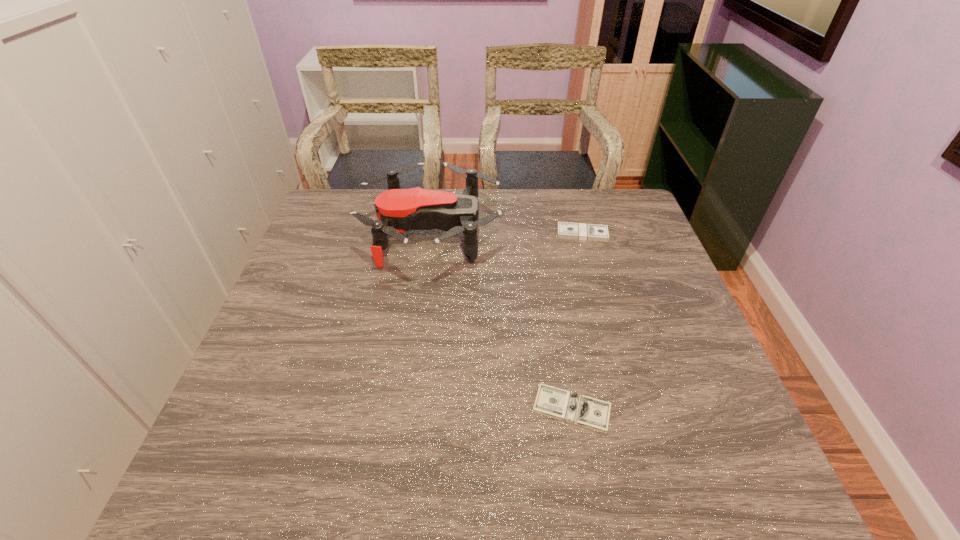
Identify the location of object that can be found as the closest to the tallest object. (565, 230).

The image size is (960, 540). In order to click on the second closest object relative to the shorter dollar in this screenshot , I will do `click(565, 230)`.

Identify the location of free location that satisfies the following two spatial constraints: 1. on the camera side of the tallest object; 2. on the back side of the taller dollar. (432, 234).

Find the location of `free space that satisfies the following two spatial constraints: 1. on the camera side of the tallest object; 2. on the back side of the shorter dollar`. free space that satisfies the following two spatial constraints: 1. on the camera side of the tallest object; 2. on the back side of the shorter dollar is located at coordinates (409, 409).

The width and height of the screenshot is (960, 540). In order to click on vacant space that satisfies the following two spatial constraints: 1. on the camera side of the leftmost object; 2. on the left side of the taller dollar in this screenshot , I will do `click(432, 234)`.

This screenshot has height=540, width=960. Find the location of `free space that satisfies the following two spatial constraints: 1. on the camera side of the drone; 2. on the back side of the second shortest object`. free space that satisfies the following two spatial constraints: 1. on the camera side of the drone; 2. on the back side of the second shortest object is located at coordinates (432, 234).

You are a GUI agent. You are given a task and a screenshot of the screen. Output one action in this format:
    pyautogui.click(x=<x>, y=<y>)
    Task: Click on the free space in the image that satisfies the following two spatial constraints: 1. on the camera side of the shorter dollar; 2. on the right side of the leftmost object
    The width and height of the screenshot is (960, 540).
    Given the screenshot: What is the action you would take?
    pyautogui.click(x=409, y=409)

Identify the location of free space in the image that satisfies the following two spatial constraints: 1. on the camera side of the tallest object; 2. on the left side of the second tallest object. (432, 234).

This screenshot has height=540, width=960. What are the coordinates of `free space that satisfies the following two spatial constraints: 1. on the camera side of the leftmost object; 2. on the right side of the taller dollar` in the screenshot? It's located at (432, 234).

Identify the location of vacant area that satisfies the following two spatial constraints: 1. on the back side of the shorter dollar; 2. on the camera side of the leftmost object. (541, 231).